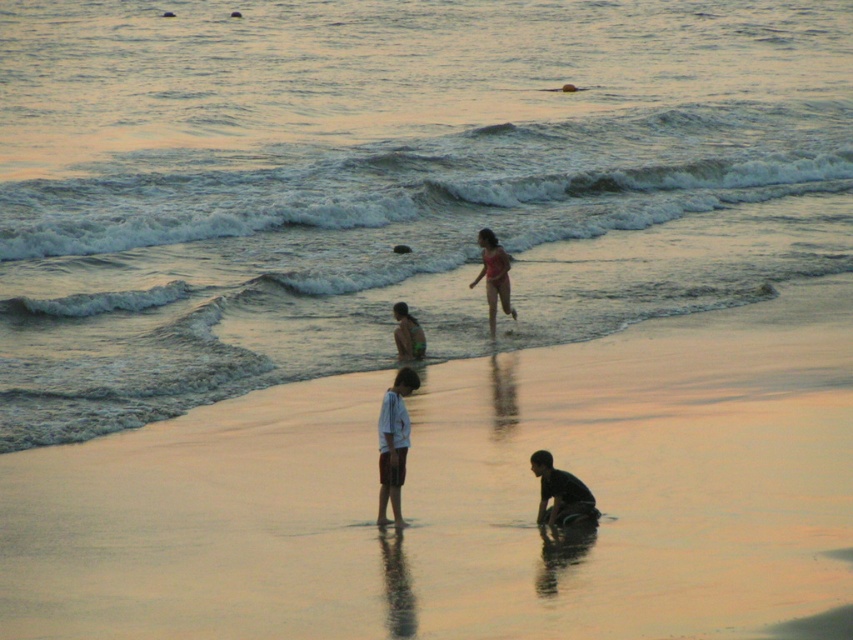
Does white cotton shirt at center have a larger size compared to dark skin/texture person at lower center?

Correct, white cotton shirt at center is larger in size than dark skin/texture person at lower center.

Looking at this image, measure the distance between white cotton shirt at center and dark skin/texture person at lower center.

The distance of white cotton shirt at center from dark skin/texture person at lower center is 37.54 inches.

You are a GUI agent. You are given a task and a screenshot of the screen. Output one action in this format:
    pyautogui.click(x=<x>, y=<y>)
    Task: Click on the white cotton shirt at center
    The image size is (853, 640).
    Given the screenshot: What is the action you would take?
    pyautogui.click(x=393, y=444)

I want to click on white cotton shirt at center, so click(x=393, y=444).

Is shiny silver water at center to the left of white cotton shirt at center from the viewer's perspective?

Yes, shiny silver water at center is to the left of white cotton shirt at center.

Where is `shiny silver water at center`? The image size is (853, 640). shiny silver water at center is located at coordinates (390, 182).

Locate an element on the screen. This screenshot has height=640, width=853. shiny silver water at center is located at coordinates (390, 182).

Does point (728, 380) lie behind point (405, 406)?

That is True.

What do you see at coordinates (466, 496) in the screenshot? This screenshot has width=853, height=640. I see `smooth sand at center` at bounding box center [466, 496].

You are a GUI agent. You are given a task and a screenshot of the screen. Output one action in this format:
    pyautogui.click(x=<x>, y=<y>)
    Task: Click on the smooth sand at center
    Image resolution: width=853 pixels, height=640 pixels.
    Given the screenshot: What is the action you would take?
    pyautogui.click(x=466, y=496)

Identify the location of smooth sand at center. This screenshot has width=853, height=640. (466, 496).